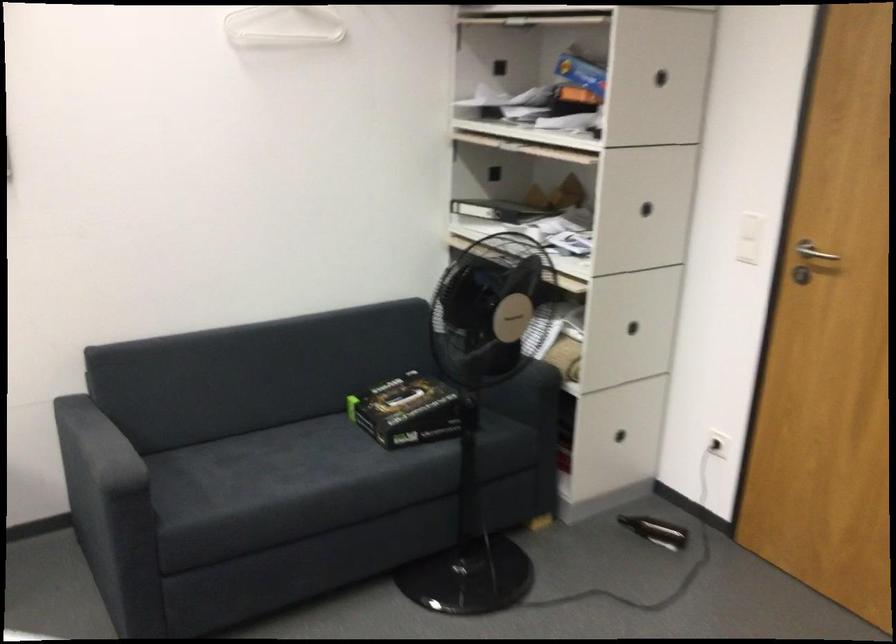
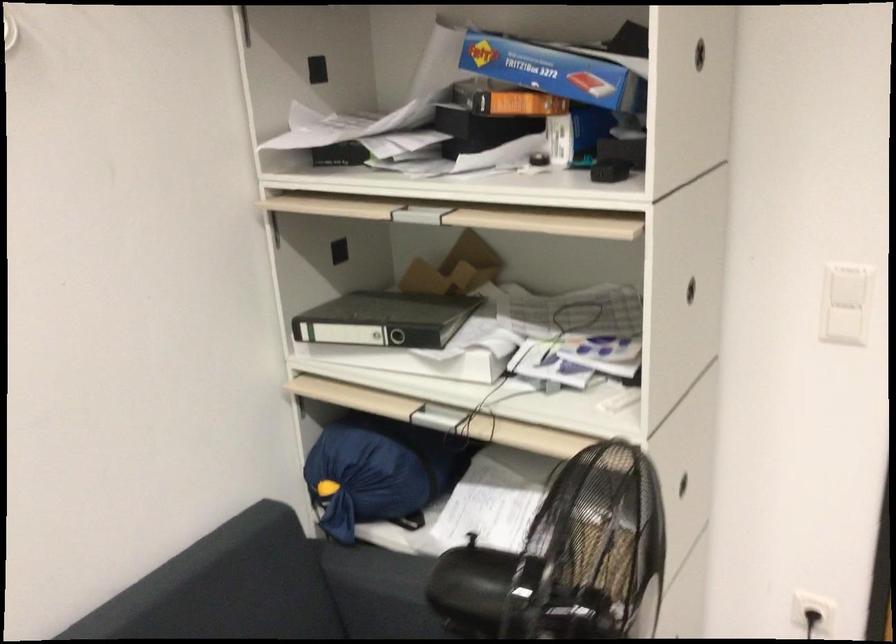
Question: I am providing you with two images of the same scene from different viewpoints. Which of the following objects are not visible in image2?

Choices:
 (A) black ring binder
 (B) blue drawstring bag
 (C) round cabinet handle
 (D) none of these

Answer: (D)